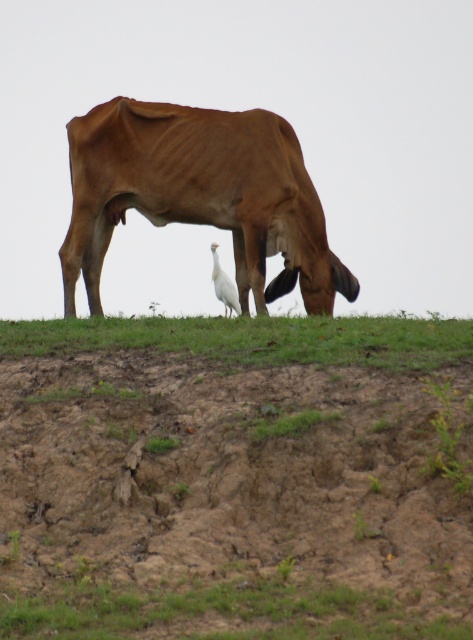
Question: Which is farther from the green grass at lower center?

Choices:
 (A) white smooth bird at center
 (B) brown glossy cow at center

Answer: (A)

Question: Does brown glossy cow at center appear under green grass at lower center?

Choices:
 (A) no
 (B) yes

Answer: (A)

Question: Does green grass at lower center have a greater width compared to white smooth bird at center?

Choices:
 (A) yes
 (B) no

Answer: (A)

Question: Which is farther from the green grass at lower center?

Choices:
 (A) white smooth bird at center
 (B) brown glossy cow at center

Answer: (A)

Question: Does brown glossy cow at center appear on the left side of white smooth bird at center?

Choices:
 (A) yes
 (B) no

Answer: (A)

Question: Which of these objects is positioned farthest from the green grass at lower center?

Choices:
 (A) brown glossy cow at center
 (B) white smooth bird at center

Answer: (B)